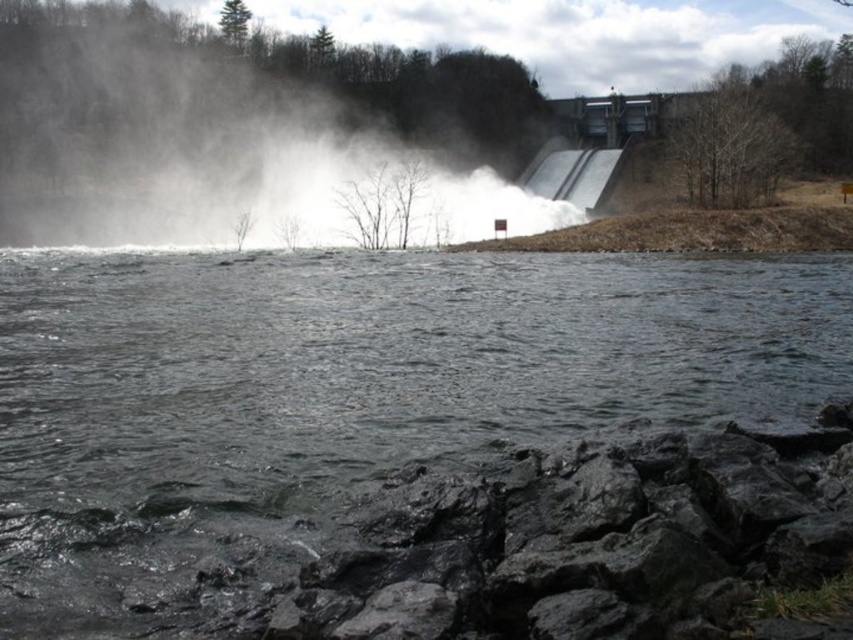
Question: Which point is farther to the camera?

Choices:
 (A) (585, 349)
 (B) (492, 509)

Answer: (A)

Question: Which of the following is the farthest from the observer?

Choices:
 (A) (570, 168)
 (B) (289, 52)
 (C) (804, 540)

Answer: (B)

Question: Which object appears farthest from the camera in this image?

Choices:
 (A) white mist at upper center
 (B) dark gray stone at lower center
 (C) dark gray rock at lower center
 (D) gray metallic dam at upper right

Answer: (D)

Question: Is dark gray stone at lower center closer to the viewer compared to white mist at upper center?

Choices:
 (A) yes
 (B) no

Answer: (A)

Question: Is dark gray stone at lower center positioned in front of white mist at upper center?

Choices:
 (A) no
 (B) yes

Answer: (B)

Question: From the image, what is the correct spatial relationship of dark gray stone at lower center in relation to gray metallic dam at upper right?

Choices:
 (A) left
 (B) right

Answer: (A)